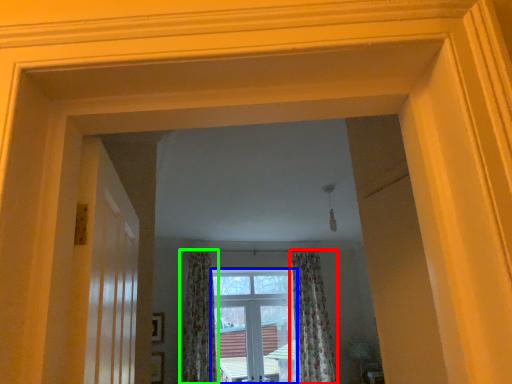
Question: Considering the real-world distances, which object is closest to curtain (highlighted by a red box)? window (highlighted by a blue box) or curtain (highlighted by a green box).

Choices:
 (A) window
 (B) curtain

Answer: (A)